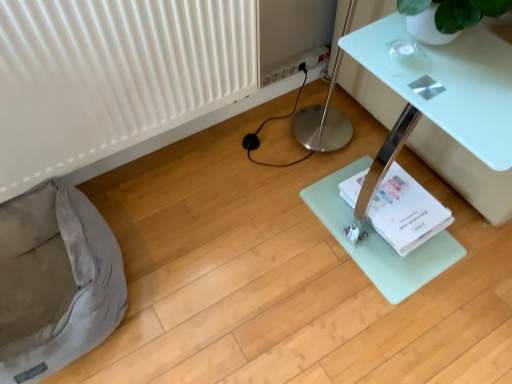
This screenshot has height=384, width=512. I want to click on free area in between white paper at lower right and gray fabric bean bag at lower left, so click(x=229, y=248).